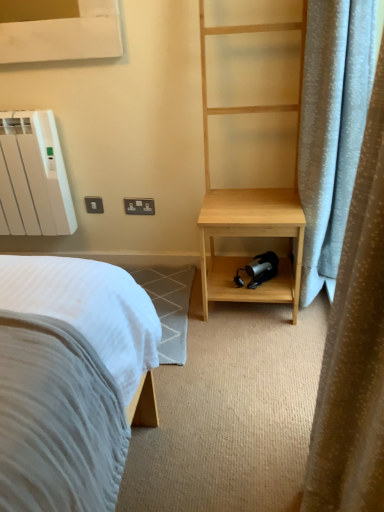
Question: Is the depth of white matte radiator at upper left less than that of light blue fabric curtain at right?

Choices:
 (A) no
 (B) yes

Answer: (A)

Question: Is white matte radiator at upper left oriented towards light blue fabric curtain at right?

Choices:
 (A) no
 (B) yes

Answer: (A)

Question: Considering the relative sizes of white matte radiator at upper left and light blue fabric curtain at right in the image provided, is white matte radiator at upper left thinner than light blue fabric curtain at right?

Choices:
 (A) yes
 (B) no

Answer: (A)

Question: Is white matte radiator at upper left not inside light blue fabric curtain at right?

Choices:
 (A) yes
 (B) no

Answer: (A)

Question: Is the depth of white matte radiator at upper left greater than that of light blue fabric curtain at right?

Choices:
 (A) yes
 (B) no

Answer: (A)

Question: From their relative heights in the image, would you say light blue fabric curtain at right is taller or shorter than white matte radiator at upper left?

Choices:
 (A) tall
 (B) short

Answer: (A)

Question: From a real-world perspective, is light blue fabric curtain at right physically located above or below white matte radiator at upper left?

Choices:
 (A) above
 (B) below

Answer: (A)

Question: In terms of size, does light blue fabric curtain at right appear bigger or smaller than white matte radiator at upper left?

Choices:
 (A) small
 (B) big

Answer: (B)

Question: Is point (347, 436) closer or farther from the camera than point (66, 228)?

Choices:
 (A) farther
 (B) closer

Answer: (B)

Question: From the image's perspective, is white plastic electric outlet at upper center positioned above or below natural wood bookshelf at right?

Choices:
 (A) below
 (B) above

Answer: (A)

Question: Is white plastic electric outlet at upper center in front of or behind natural wood bookshelf at right in the image?

Choices:
 (A) front
 (B) behind

Answer: (B)

Question: In terms of width, does white plastic electric outlet at upper center look wider or thinner when compared to natural wood bookshelf at right?

Choices:
 (A) thin
 (B) wide

Answer: (A)

Question: Considering the positions of point (135, 212) and point (213, 237), is point (135, 212) closer or farther from the camera than point (213, 237)?

Choices:
 (A) closer
 (B) farther

Answer: (B)

Question: From the image's perspective, is white matte radiator at upper left above or below light blue fabric curtain at right?

Choices:
 (A) above
 (B) below

Answer: (A)

Question: From a real-world perspective, is white matte radiator at upper left above or below light blue fabric curtain at right?

Choices:
 (A) above
 (B) below

Answer: (B)